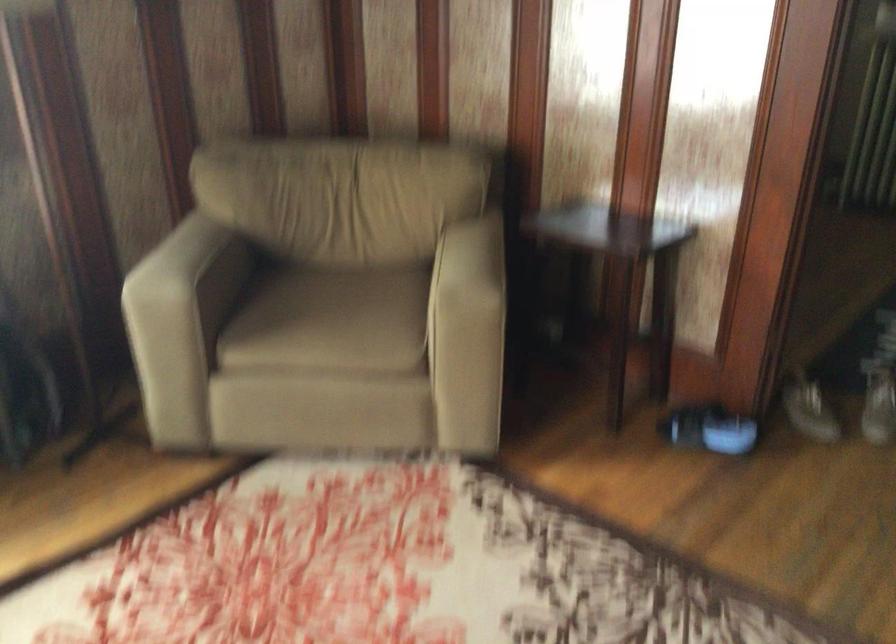
Image resolution: width=896 pixels, height=644 pixels. Describe the element at coordinates (331, 321) in the screenshot. I see `a chair sitting surface` at that location.